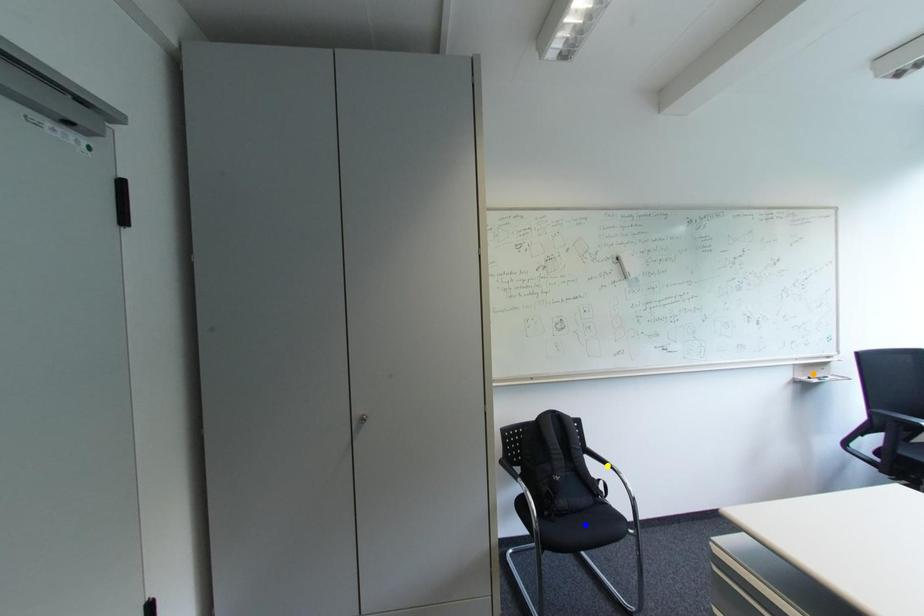
Order these from nearest to farthest:
- yellow point
- blue point
- orange point

blue point, yellow point, orange point